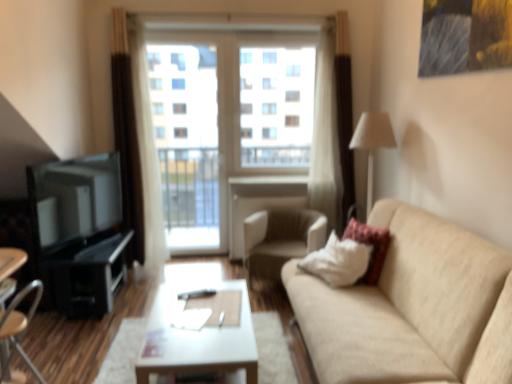
Locate an element on the screen. This screenshot has height=384, width=512. matte black tv at left is located at coordinates (75, 198).

What is the approximate height of white fabric lampshade at right?

white fabric lampshade at right is 3.43 feet in height.

The height and width of the screenshot is (384, 512). What do you see at coordinates (276, 105) in the screenshot?
I see `transparent glass window at center` at bounding box center [276, 105].

Measure the distance between transparent glass window at center and camera.

The depth of transparent glass window at center is 4.16 meters.

What do you see at coordinates (19, 326) in the screenshot? I see `wooden chair at lower left, placed as the 2th chair when sorted from right to left` at bounding box center [19, 326].

In the scene shown: How much space does beige fabric armchair at center, which ranks as the 2th chair in front-to-back order, occupy horizontally?

It is 24.19 inches.

The height and width of the screenshot is (384, 512). What do you see at coordinates (370, 244) in the screenshot?
I see `velvet-like beige pillow at right` at bounding box center [370, 244].

This screenshot has height=384, width=512. Find the location of `beige fabric couch at right`. beige fabric couch at right is located at coordinates (412, 308).

Considering the relative positions of transparent glass screen door at center and velvet-like beige pillow at right in the image provided, is transparent glass screen door at center to the left or to the right of velvet-like beige pillow at right?

In the image, transparent glass screen door at center appears on the left side of velvet-like beige pillow at right.

Would you say transparent glass screen door at center is outside velvet-like beige pillow at right?

Yes, transparent glass screen door at center is not within velvet-like beige pillow at right.

Considering the sizes of transparent glass screen door at center and velvet-like beige pillow at right in the image, is transparent glass screen door at center taller or shorter than velvet-like beige pillow at right?

In the image, transparent glass screen door at center appears to be taller than velvet-like beige pillow at right.

Can you confirm if white glossy coffee table at center is positioned to the left of transparent glass window at center?

Yes, white glossy coffee table at center is to the left of transparent glass window at center.

Does point (183, 341) come farther from viewer compared to point (253, 78)?

That is False.

Considering their positions, is white glossy coffee table at center located in front of or behind transparent glass window at center?

In the image, white glossy coffee table at center appears in front of transparent glass window at center.

Is white glossy coffee table at center taller than transparent glass window at center?

No, white glossy coffee table at center is not taller than transparent glass window at center.

Is matte black tv at left further to the viewer compared to wooden chair at lower left, which appears as the 1th chair when viewed from the front?

Yes, the depth of matte black tv at left is greater than that of wooden chair at lower left, which appears as the 1th chair when viewed from the front.

Does matte black tv at left touch wooden chair at lower left, which appears as the 1th chair when viewed from the front?

matte black tv at left and wooden chair at lower left, which appears as the 1th chair when viewed from the front, are not in contact.

Considering the relative sizes of matte black tv at left and wooden chair at lower left, which appears as the 1th chair when viewed from the left, in the image provided, is matte black tv at left thinner than wooden chair at lower left, which appears as the 1th chair when viewed from the left,?

Yes, matte black tv at left is thinner than wooden chair at lower left, which appears as the 1th chair when viewed from the left.

Does point (76, 180) lie behind point (19, 301)?

That is True.

Is point (297, 127) positioned before point (76, 173)?

No, (297, 127) is behind (76, 173).

How different are the orientations of transparent glass window at center and matte black tv at left in degrees?

They differ by 70.2 degrees in their facing directions.

Is transparent glass window at center looking in the opposite direction of matte black tv at left?

No, transparent glass window at center is not facing the opposite direction of matte black tv at left.

Considering the sizes of objects transparent glass window at center and matte black tv at left in the image provided, who is thinner, transparent glass window at center or matte black tv at left?

matte black tv at left.

Considering the positions of objects beige fabric couch at right and beige fabric armchair at center, the 1th chair when ordered from back to front, in the image provided, who is behind, beige fabric couch at right or beige fabric armchair at center, the 1th chair when ordered from back to front,?

beige fabric armchair at center, the 1th chair when ordered from back to front, is further from the camera.

Is beige fabric couch at right turned away from beige fabric armchair at center, which ranks as the 2th chair in front-to-back order?

beige fabric couch at right does not have its back to beige fabric armchair at center, which ranks as the 2th chair in front-to-back order.

From the image's perspective, which is below, beige fabric couch at right or beige fabric armchair at center, which ranks as the 2th chair in front-to-back order?

beige fabric couch at right, from the image's perspective.

Can you confirm if beige fabric couch at right is thinner than beige fabric armchair at center, which is the 1th chair in right-to-left order?

No, beige fabric couch at right is not thinner than beige fabric armchair at center, which is the 1th chair in right-to-left order.

How different are the orientations of matte black tv at left and velvet-like beige pillow at right in degrees?

The angular difference between matte black tv at left and velvet-like beige pillow at right is 160 degrees.

Does matte black tv at left have a lesser width compared to velvet-like beige pillow at right?

Yes, matte black tv at left is thinner than velvet-like beige pillow at right.

Looking at this image, is matte black tv at left turned away from velvet-like beige pillow at right?

matte black tv at left does not have its back to velvet-like beige pillow at right.

From a real-world perspective, relative to velvet-like beige pillow at right, is matte black tv at left vertically above or below?

Clearly, from a real-world perspective, matte black tv at left is above velvet-like beige pillow at right.

Is transparent glass screen door at center bigger than white glossy coffee table at center?

Incorrect, transparent glass screen door at center is not larger than white glossy coffee table at center.

Is transparent glass screen door at center positioned beyond the bounds of white glossy coffee table at center?

Indeed, transparent glass screen door at center is completely outside white glossy coffee table at center.

Which is less distant, (188,90) or (196,364)?

Point (188,90) appears to be farther away from the viewer than point (196,364).

Does transparent glass screen door at center have a greater height compared to white glossy coffee table at center?

Yes, transparent glass screen door at center is taller than white glossy coffee table at center.

Find the location of a particular element. The image size is (512, 384). pillow in front of the transparent glass screen door at center is located at coordinates (370, 244).

At what (x,y) coordinates should I click in order to perform the action: click on window screen above the white glossy coffee table at center (from the image's perspective). Please return your answer as a coordinate pair (x, y). Looking at the image, I should click on (276, 105).

When comparing their distances from wooden chair at lower left, which appears as the 1th chair when viewed from the left, does transparent glass screen door at center or white glossy coffee table at center seem closer?

Based on the image, white glossy coffee table at center appears to be nearer to wooden chair at lower left, which appears as the 1th chair when viewed from the left.

From the picture: From the image, which object appears to be nearer to velvet-like beige pillow at right, white fabric lampshade at right or wooden chair at lower left, which appears as the 1th chair when viewed from the left?

white fabric lampshade at right is positioned closer to the anchor velvet-like beige pillow at right.

Estimate the real-world distances between objects in this image. Which object is further from beige fabric armchair at center, positioned as the 2th chair in left-to-right order, beige fabric couch at right or transparent glass screen door at center?

Based on the image, transparent glass screen door at center appears to be further to beige fabric armchair at center, positioned as the 2th chair in left-to-right order.

Which object lies further to the anchor point white fabric lampshade at right, matte black tv at left or transparent glass screen door at center?

matte black tv at left is further to white fabric lampshade at right.

From the image, which object appears to be nearer to white glossy coffee table at center, beige fabric couch at right or transparent glass screen door at center?

beige fabric couch at right is positioned closer to the anchor white glossy coffee table at center.

Looking at the image, which one is located further to beige fabric couch at right, velvet-like beige pillow at right or transparent glass screen door at center?

transparent glass screen door at center is positioned further to the anchor beige fabric couch at right.

Estimate the real-world distances between objects in this image. Which object is further from wooden chair at lower left, which appears as the 1th chair when viewed from the left, beige fabric armchair at center, the 1th chair when ordered from back to front, or beige fabric couch at right?

Based on the image, beige fabric couch at right appears to be further to wooden chair at lower left, which appears as the 1th chair when viewed from the left.

From the image, which object appears to be nearer to beige fabric couch at right, transparent glass window at center or wooden chair at lower left, which ranks as the second chair in back-to-front order?

Based on the image, transparent glass window at center appears to be nearer to beige fabric couch at right.

You are a GUI agent. You are given a task and a screenshot of the screen. Output one action in this format:
    pyautogui.click(x=<x>, y=<y>)
    Task: Click on the coffee table situated between matte black tv at left and beige fabric armchair at center, positioned as the 2th chair in left-to-right order, from left to right
    
    Given the screenshot: What is the action you would take?
    pos(200,337)

Identify the location of coffee table between wooden chair at lower left, which ranks as the second chair in back-to-front order, and beige fabric armchair at center, which is the 1th chair in right-to-left order, in the front-back direction. Image resolution: width=512 pixels, height=384 pixels. (200, 337).

Locate an element on the screen. Image resolution: width=512 pixels, height=384 pixels. studio couch located between matte black tv at left and white fabric lampshade at right in the left-right direction is located at coordinates (412, 308).

Where is `chair located between white glossy coffee table at center and transparent glass screen door at center in the depth direction`? This screenshot has height=384, width=512. chair located between white glossy coffee table at center and transparent glass screen door at center in the depth direction is located at coordinates (280, 239).